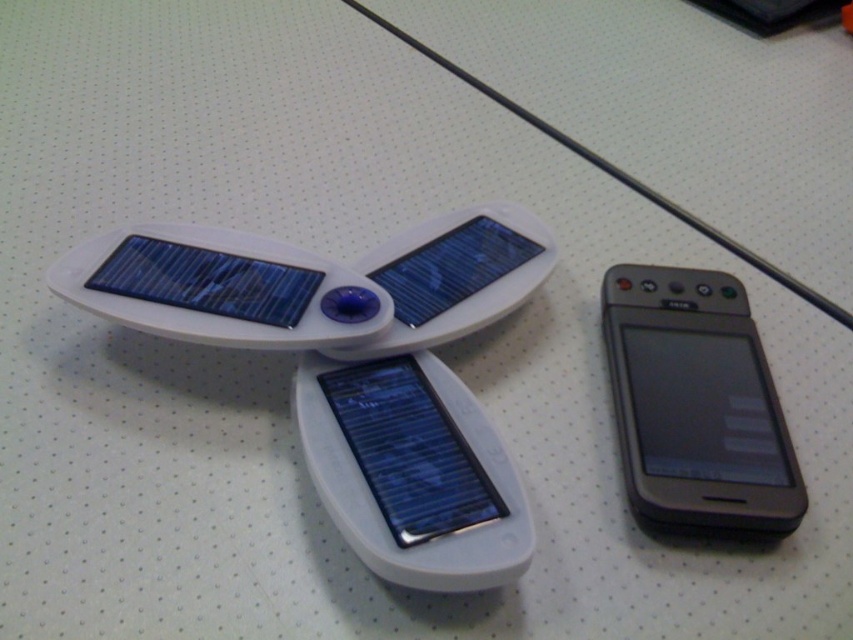
Question: Which point is closer to the camera taking this photo?

Choices:
 (A) (717, 497)
 (B) (451, 502)

Answer: (B)

Question: In this image, where is black matte smartphone at right located relative to slate gray metallic smartphone at center?

Choices:
 (A) left
 (B) right

Answer: (B)

Question: Among these points, which one is farthest from the camera?

Choices:
 (A) (358, 385)
 (B) (730, 380)

Answer: (B)

Question: Does black matte smartphone at right have a greater width compared to slate gray metallic smartphone at center?

Choices:
 (A) no
 (B) yes

Answer: (A)

Question: Can you confirm if black matte smartphone at right is smaller than slate gray metallic smartphone at center?

Choices:
 (A) no
 (B) yes

Answer: (A)

Question: Among these points, which one is farthest from the camera?

Choices:
 (A) (462, 513)
 (B) (634, 440)

Answer: (B)